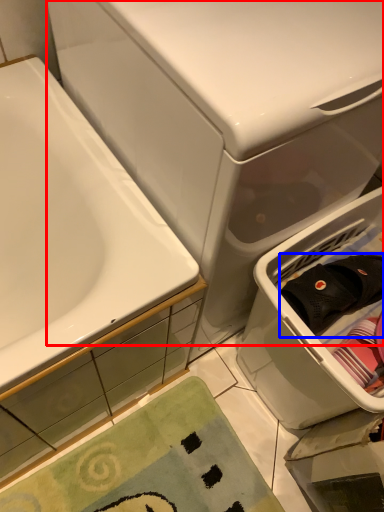
Question: Which of the following is the farthest to the observer, water tank (highlighted by a red box) or clothing (highlighted by a blue box)?

Choices:
 (A) water tank
 (B) clothing

Answer: (B)